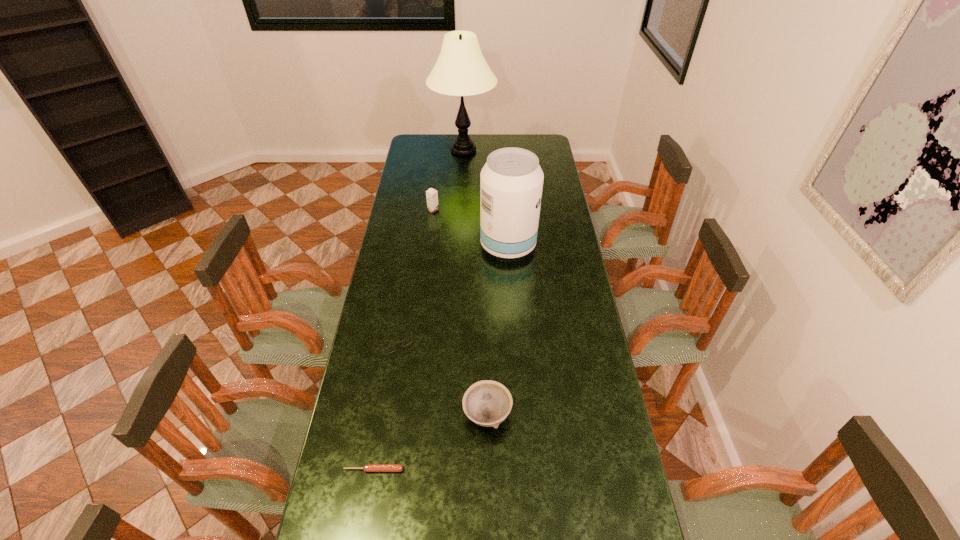
What are the coordinates of `the farthest object` in the screenshot? It's located at (461, 70).

Identify the location of lamp. (461, 70).

Identify the location of alcohol. (511, 182).

Identify the location of the third farthest object. The width and height of the screenshot is (960, 540). (511, 182).

Where is `the third tallest object`? the third tallest object is located at coordinates (432, 195).

The width and height of the screenshot is (960, 540). Find the location of `the fifth nearest object`. the fifth nearest object is located at coordinates (432, 195).

Find the location of `the fifth farthest object`. the fifth farthest object is located at coordinates (487, 403).

Locate an element on the screen. This screenshot has width=960, height=540. bowl is located at coordinates (487, 403).

At what (x,y) coordinates should I click in order to perform the action: click on the third nearest object. Please return your answer as a coordinate pair (x, y). This screenshot has height=540, width=960. Looking at the image, I should click on (408, 340).

Find the location of a particular element. spectacles is located at coordinates (408, 340).